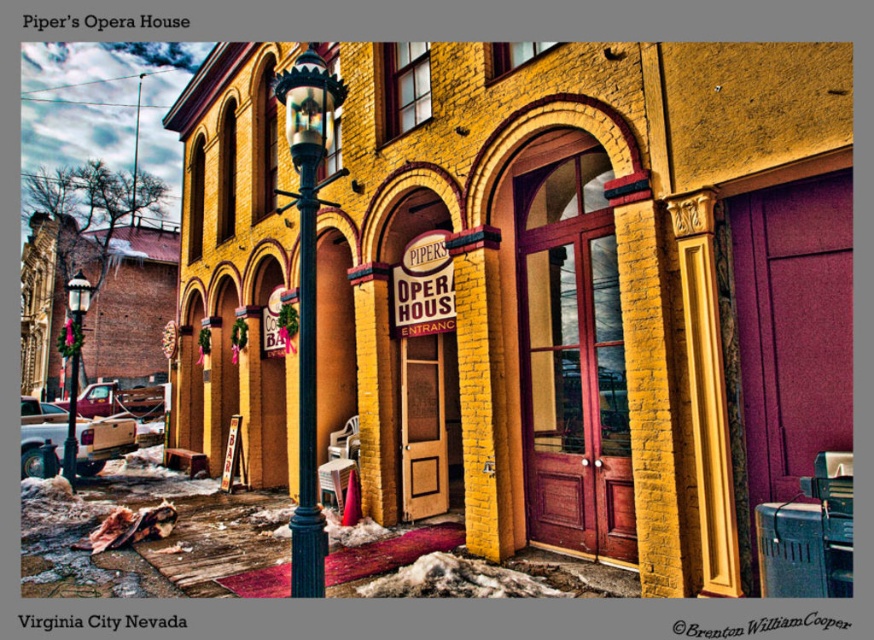
You are standing in front of Piper Opera House and want to locate two points marked on the building. The first point is at coordinate point (320, 582) and the second point is at coordinate point (293, 518). Which point is closer to you?

Point (320, 582) is closer to the viewer than point (293, 518).